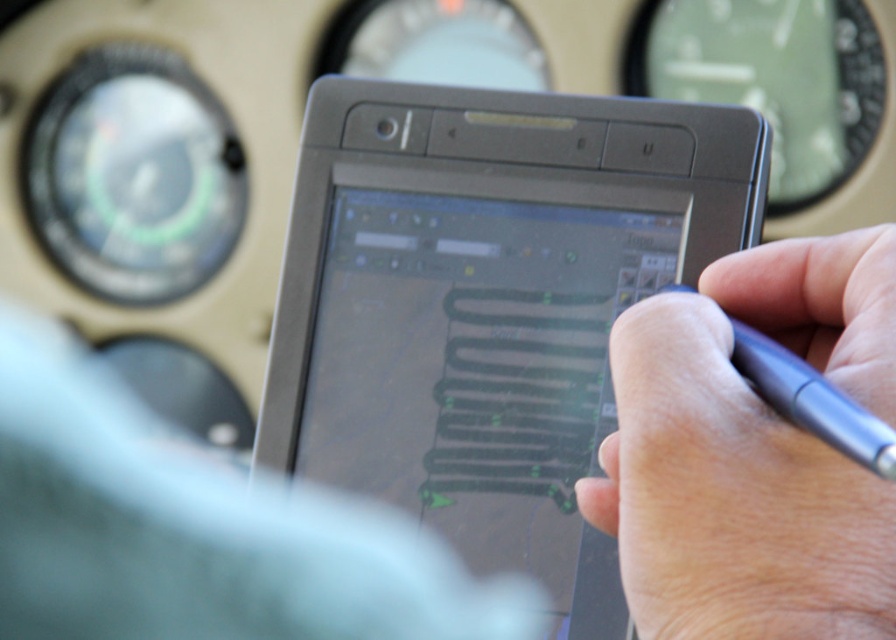
Measure the distance between black matte tablet at center and camera.

The distance of black matte tablet at center from camera is 21.43 inches.

Can you confirm if black matte tablet at center is positioned to the left of metallic blue pen at right?

Indeed, black matte tablet at center is positioned on the left side of metallic blue pen at right.

What do you see at coordinates (488, 304) in the screenshot?
I see `black matte tablet at center` at bounding box center [488, 304].

Where is `black matte tablet at center`? black matte tablet at center is located at coordinates (488, 304).

The height and width of the screenshot is (640, 896). What do you see at coordinates (488, 304) in the screenshot?
I see `black matte tablet at center` at bounding box center [488, 304].

How distant is black matte tablet at center from white matte pen at center?

black matte tablet at center is 7.61 inches away from white matte pen at center.

Find the location of a particular element. This screenshot has height=640, width=896. black matte tablet at center is located at coordinates (488, 304).

Is point (688, 518) positioned in front of point (843, 445)?

No, (688, 518) is behind (843, 445).

Between point (718, 358) and point (763, 333), which one is positioned in front?

Positioned in front is point (718, 358).

Find the location of a particular element. This screenshot has height=640, width=896. white matte pen at center is located at coordinates (752, 451).